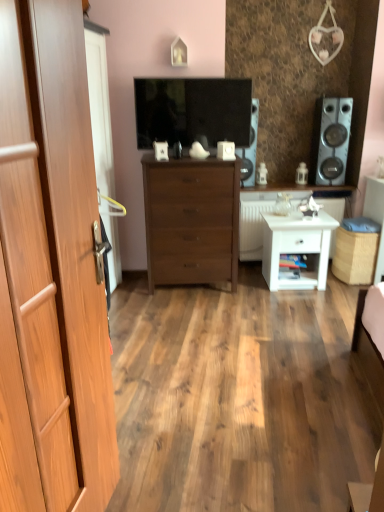
Question: Is white glossy side table at center right, marked as the 1th counter top in a bottom-to-top arrangement, in front of wooden cabinet at center, the 1th counter top when ordered from top to bottom?

Choices:
 (A) yes
 (B) no

Answer: (A)

Question: Considering the relative sizes of white glossy side table at center right, placed as the 2th counter top when sorted from top to bottom, and wooden cabinet at center, the 1th counter top when ordered from top to bottom, in the image provided, is white glossy side table at center right, placed as the 2th counter top when sorted from top to bottom, thinner than wooden cabinet at center, the 1th counter top when ordered from top to bottom,?

Choices:
 (A) yes
 (B) no

Answer: (B)

Question: From a real-world perspective, is white glossy side table at center right, marked as the 1th counter top in a bottom-to-top arrangement, positioned over wooden cabinet at center, which is the second counter top in bottom-to-top order, based on gravity?

Choices:
 (A) yes
 (B) no

Answer: (B)

Question: Is white glossy side table at center right, placed as the 2th counter top when sorted from top to bottom, to the left of wooden cabinet at center, the 1th counter top when ordered from top to bottom, from the viewer's perspective?

Choices:
 (A) no
 (B) yes

Answer: (B)

Question: Is white glossy side table at center right, marked as the 1th counter top in a bottom-to-top arrangement, touching wooden cabinet at center, the 1th counter top when ordered from top to bottom?

Choices:
 (A) no
 (B) yes

Answer: (A)

Question: Is wooden cabinet at center, the 1th counter top when ordered from top to bottom, a part of white glossy side table at center right, placed as the 2th counter top when sorted from top to bottom?

Choices:
 (A) yes
 (B) no

Answer: (B)

Question: Is white matte nightstand at lower right surrounded by matte black tv at center?

Choices:
 (A) yes
 (B) no

Answer: (B)

Question: Is white matte nightstand at lower right at the back of matte black tv at center?

Choices:
 (A) yes
 (B) no

Answer: (B)

Question: Would you consider matte black tv at center to be distant from white matte nightstand at lower right?

Choices:
 (A) yes
 (B) no

Answer: (A)

Question: Is matte black tv at center to the left of white matte nightstand at lower right from the viewer's perspective?

Choices:
 (A) no
 (B) yes

Answer: (B)

Question: From a real-world perspective, is matte black tv at center below white matte nightstand at lower right?

Choices:
 (A) no
 (B) yes

Answer: (A)

Question: From the image's perspective, is matte black tv at center below white matte nightstand at lower right?

Choices:
 (A) no
 (B) yes

Answer: (A)

Question: Can you confirm if satin silver speaker at right, the 2th speaker from the left, is positioned to the left of wooden cabinet at center, the 1th counter top when ordered from top to bottom?

Choices:
 (A) no
 (B) yes

Answer: (A)